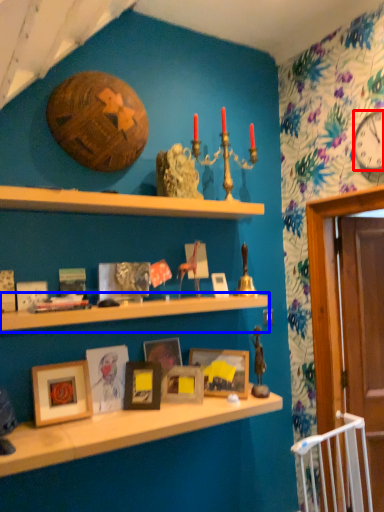
Question: Which object is further to the camera taking this photo, clock (highlighted by a red box) or shelf (highlighted by a blue box)?

Choices:
 (A) clock
 (B) shelf

Answer: (A)